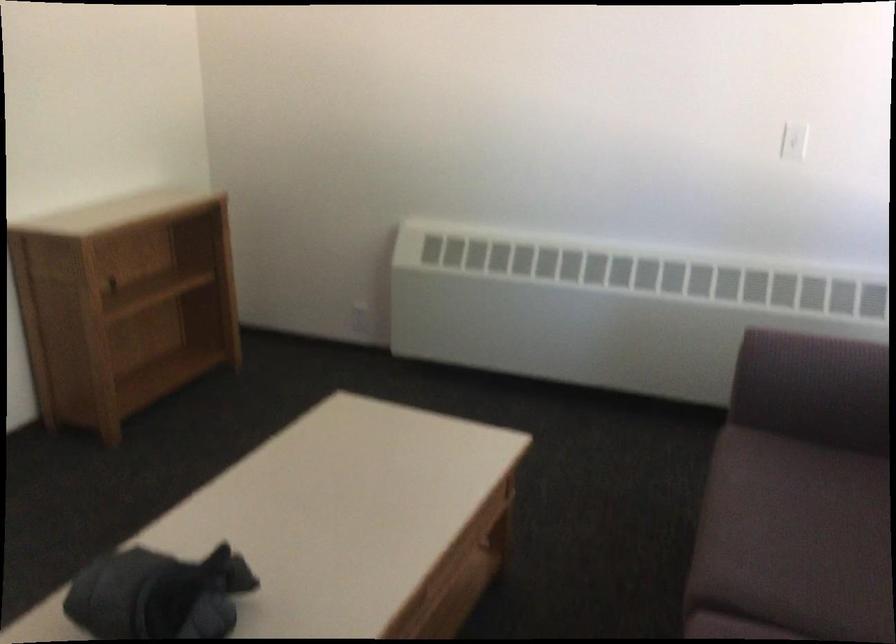
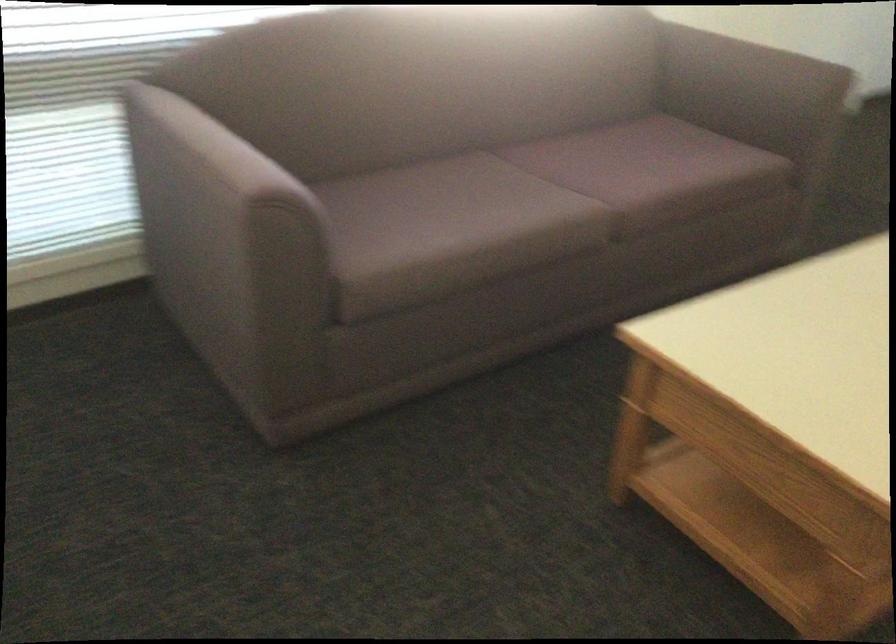
Locate, in the second image, the point that corresponds to pixel 754 545 in the first image.

(528, 205)